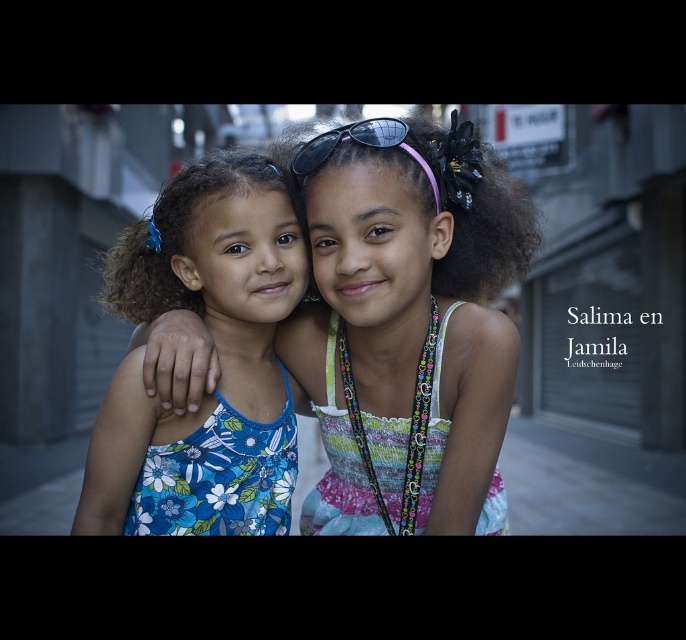
You are a photographer trying to capture a candid shot of the two girls. You notice the floral fabric dress at center and the sunglasses at center. Which object is located to the right of the other?

The floral fabric dress at center is positioned on the right side of sunglasses at center.

You are a photographer trying to capture a candid shot of the two girls. You notice the floral fabric dress at center and the sunglasses at center. How far apart are these two items in inches?

The floral fabric dress at center is 18.42 inches away from the sunglasses at center.